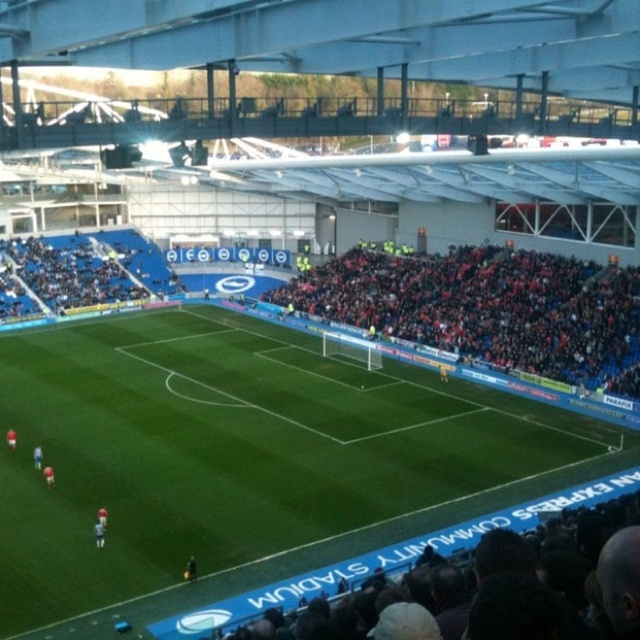
You are a photographer positioned at the edge of the stadium. You want to take a photo that includes both the green grass football field at center and the blue jersey at center. Which object should you focus on first to ensure both are in frame?

The green grass football field at center is larger in size than the blue jersey at center, so you should focus on the larger object first to ensure both fit into the frame.

You are a photographer standing at the edge of the spectator stands. You want to take a photo of both the green grass football field at center and the blue jersey at center. Which object should you focus on first to ensure both are in sharp focus?

The green grass football field at center is much taller than the blue jersey at center, so you should focus on the green grass football field at center first to ensure both are in sharp focus.